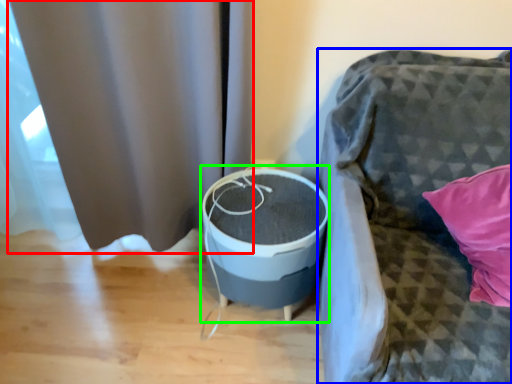
Question: Which object is the closest to the curtain (highlighted by a red box)? Choose among these: furniture (highlighted by a blue box) or round table (highlighted by a green box).

Choices:
 (A) furniture
 (B) round table

Answer: (B)